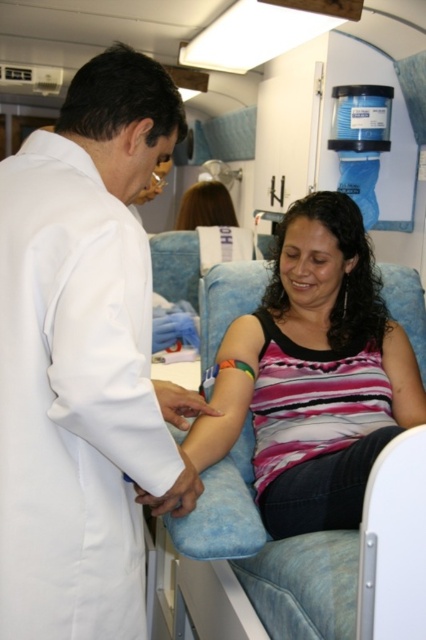
You are a patient in a medical facility and need to locate the healthcare professional wearing the white smooth lab coat at left. According to the coordinates provided, where should you look in the image to find them?

The white smooth lab coat at left is located at coordinates point (85, 360).

You are a medical assistant observing a blood draw procedure. You notice the pink striped tank top at center and the shiny brown hair at upper center. Which object is located lower in the image?

The pink striped tank top at center is positioned under the shiny brown hair at upper center, so it is located lower in the image.

You are a patient in a medical facility and see the white smooth lab coat at left and the shiny brown hair at upper center. Which object is higher in the image?

The white smooth lab coat at left is taller than the shiny brown hair at upper center in the image.